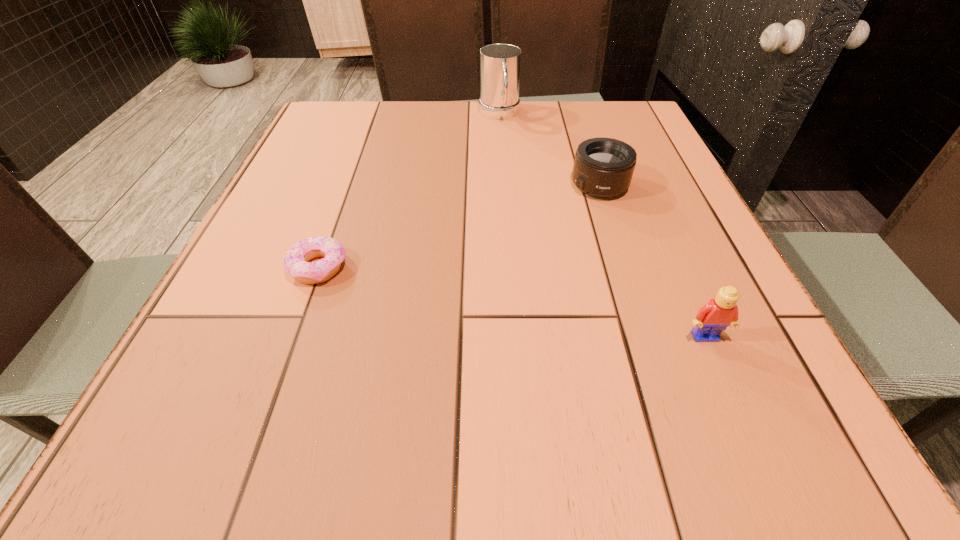
In the image, there is a desktop. At what (x,y) coordinates should I click in order to perform the action: click on vacant space at the near edge. Please return your answer as a coordinate pair (x, y). Looking at the image, I should click on (342, 366).

At what (x,y) coordinates should I click in order to perform the action: click on free region at the left edge of the desktop. Please return your answer as a coordinate pair (x, y). The height and width of the screenshot is (540, 960). Looking at the image, I should click on (265, 231).

Image resolution: width=960 pixels, height=540 pixels. What are the coordinates of `vacant region at the right edge of the desktop` in the screenshot? It's located at (714, 280).

The height and width of the screenshot is (540, 960). I want to click on vacant space at the far left corner of the desktop, so click(x=368, y=102).

Image resolution: width=960 pixels, height=540 pixels. I want to click on vacant position at the far right corner of the desktop, so click(595, 130).

You are a GUI agent. You are given a task and a screenshot of the screen. Output one action in this format:
    pyautogui.click(x=<x>, y=<y>)
    Task: Click on the free space between the telephoto lens and the second object from left to right
    
    Given the screenshot: What is the action you would take?
    pyautogui.click(x=549, y=150)

At what (x,y) coordinates should I click in order to perform the action: click on unoccupied position between the second object from left to right and the second nearest object. Please return your answer as a coordinate pair (x, y). The image size is (960, 540). Looking at the image, I should click on pyautogui.click(x=409, y=191).

Locate an element on the screen. Image resolution: width=960 pixels, height=540 pixels. free spot between the Lego and the third farthest object is located at coordinates coord(512,302).

You are a GUI agent. You are given a task and a screenshot of the screen. Output one action in this format:
    pyautogui.click(x=<x>, y=<y>)
    Task: Click on the blank region between the second shortest object and the third object from right to left
    This screenshot has width=960, height=540.
    Given the screenshot: What is the action you would take?
    pyautogui.click(x=549, y=150)

Where is `empty space that is in between the Lego and the mug`? This screenshot has height=540, width=960. empty space that is in between the Lego and the mug is located at coordinates (602, 225).